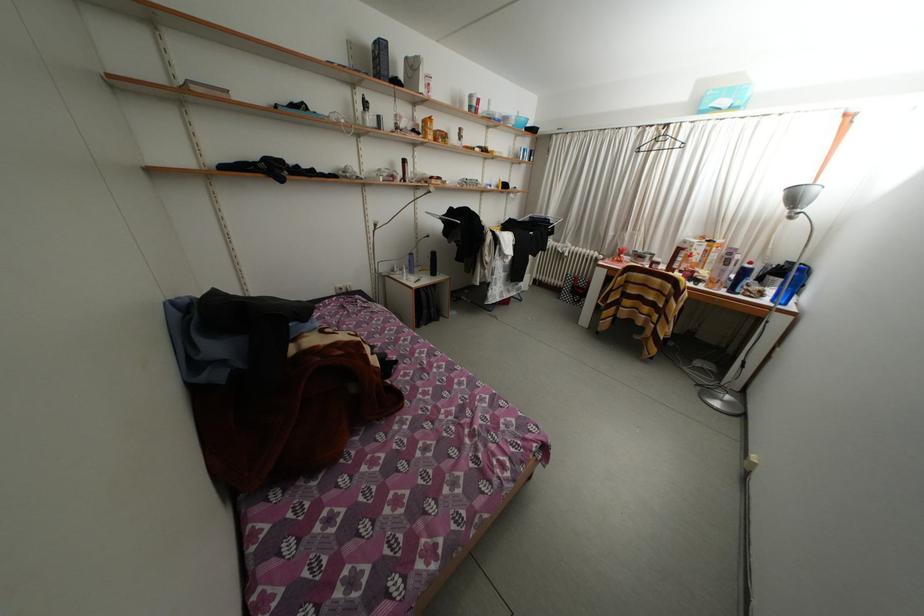
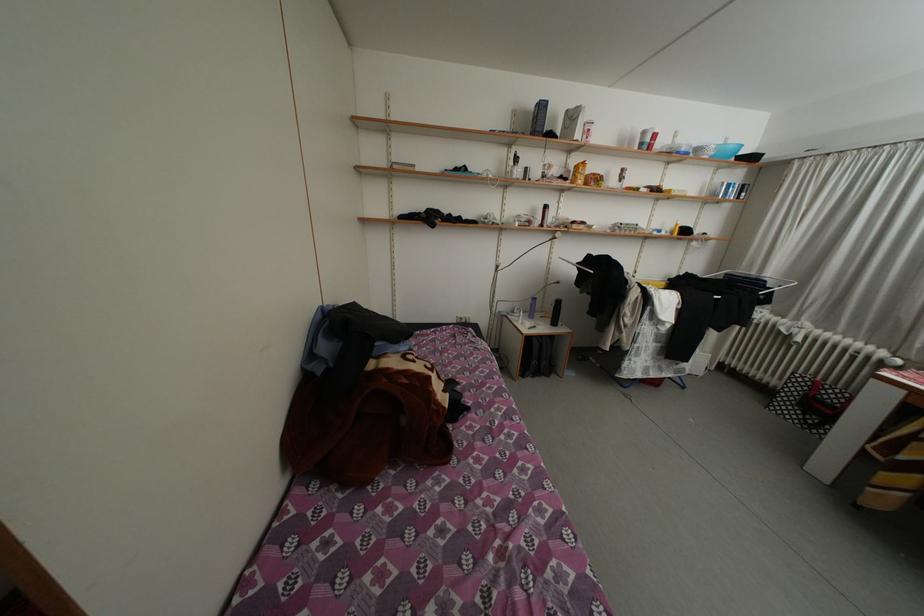
Question: The first image is from the beginning of the video and the second image is from the end. How did the camera likely rotate when shooting the video?

Choices:
 (A) Left
 (B) Right
 (C) Up
 (D) Down

Answer: (A)